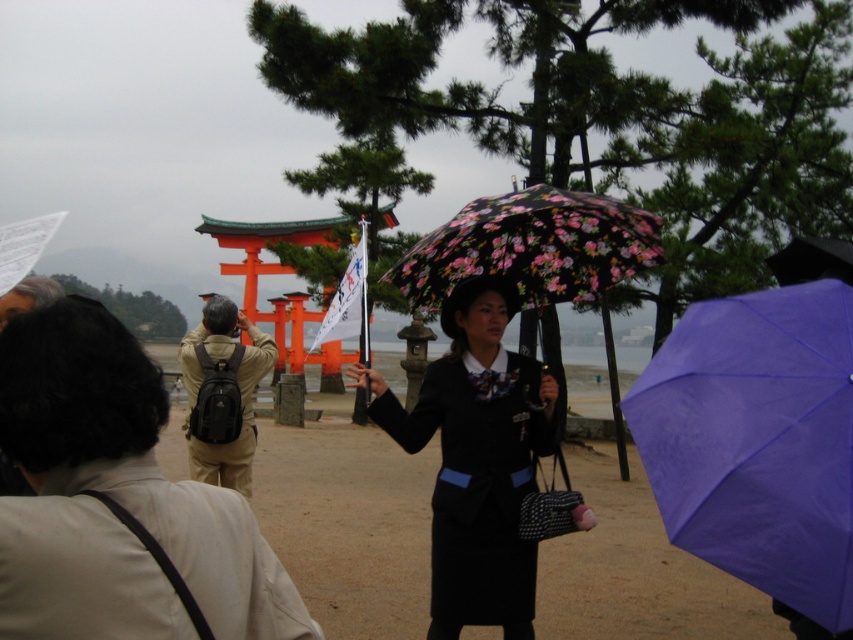
Question: Is khaki fabric pants at center closer to camera compared to black fabric dress at center?

Choices:
 (A) yes
 (B) no

Answer: (A)

Question: Can you confirm if khaki fabric pants at center is positioned to the left of purple matte umbrella at center?

Choices:
 (A) yes
 (B) no

Answer: (A)

Question: Which object appears closest to the camera in this image?

Choices:
 (A) black fabric dress at center
 (B) purple matte umbrella at center

Answer: (B)

Question: Is purple matte umbrella at center wider than black fabric dress at center?

Choices:
 (A) yes
 (B) no

Answer: (B)

Question: Which of the following is the closest to the observer?

Choices:
 (A) black fabric dress at center
 (B) khaki fabric pants at center
 (C) purple matte umbrella at center
 (D) floral-patterned fabric umbrella at center

Answer: (B)

Question: Which object is farther from the camera taking this photo?

Choices:
 (A) black fabric dress at center
 (B) purple matte umbrella at center

Answer: (A)